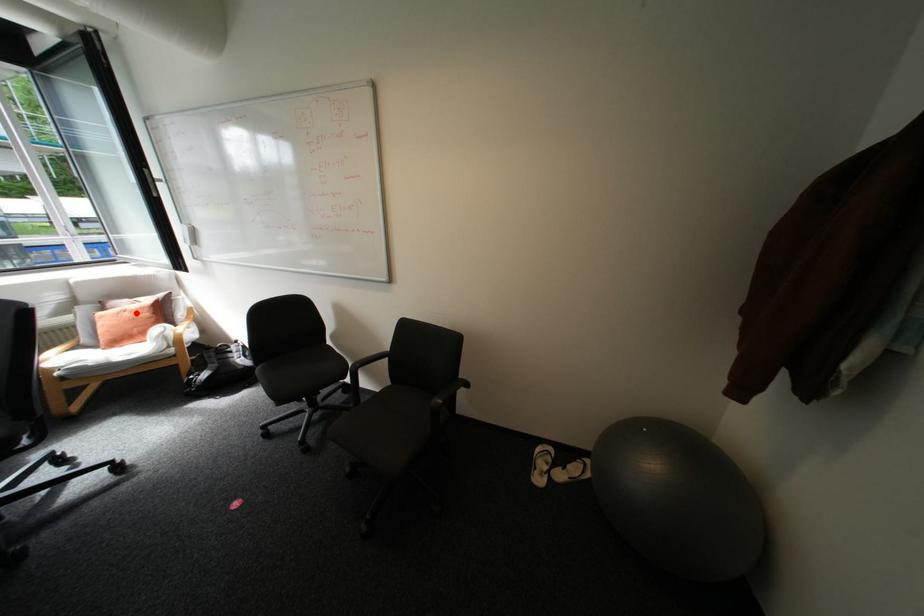
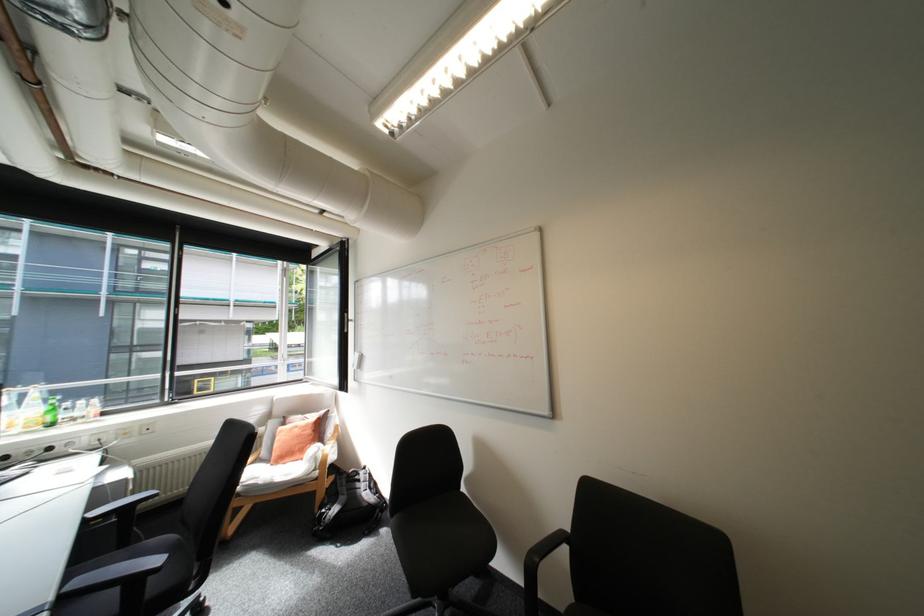
Question: I am providing you with two images of the same scene from different viewpoints. In image1, a red point is highlighted. Considering the same 3D point in image2, which of the following is correct?

Choices:
 (A) It is closer
 (B) It is farther

Answer: (B)